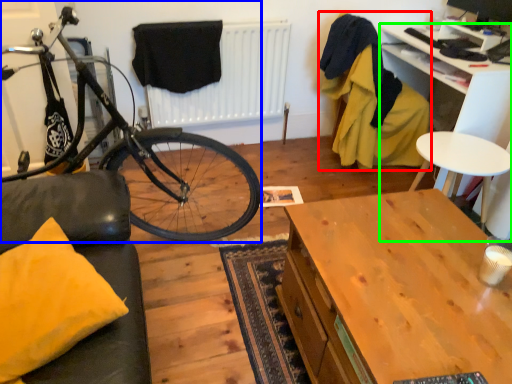
Question: Considering the real-world distances, which object is farthest from armchair (highlighted by a red box)? bicycle (highlighted by a blue box) or desk (highlighted by a green box)?

Choices:
 (A) bicycle
 (B) desk

Answer: (A)